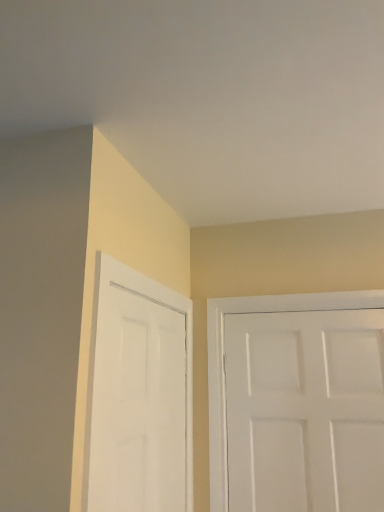
Question: Can you confirm if white matte door at left, placed as the 2th door when sorted from right to left, is bigger than white matte door at right, which is counted as the second door, starting from the left?

Choices:
 (A) yes
 (B) no

Answer: (A)

Question: Is white matte door at left, placed as the 2th door when sorted from right to left, taller than white matte door at right, the first door from the right?

Choices:
 (A) yes
 (B) no

Answer: (B)

Question: From the image's perspective, would you say white matte door at left, placed as the 2th door when sorted from right to left, is shown under white matte door at right, which is counted as the second door, starting from the left?

Choices:
 (A) yes
 (B) no

Answer: (B)

Question: Is white matte door at left, placed as the 2th door when sorted from right to left, shorter than white matte door at right, which is counted as the second door, starting from the left?

Choices:
 (A) yes
 (B) no

Answer: (A)

Question: Is white matte door at left, the first door positioned from the left, located outside white matte door at right, the first door from the right?

Choices:
 (A) no
 (B) yes

Answer: (B)

Question: Is white matte door at left, the first door positioned from the left, facing away from white matte door at right, the first door from the right?

Choices:
 (A) yes
 (B) no

Answer: (B)

Question: Does white matte door at right, the first door from the right, appear on the right side of white matte door at left, placed as the 2th door when sorted from right to left?

Choices:
 (A) yes
 (B) no

Answer: (A)

Question: Considering the relative sizes of white matte door at right, the first door from the right, and white matte door at left, the first door positioned from the left, in the image provided, is white matte door at right, the first door from the right, taller than white matte door at left, the first door positioned from the left,?

Choices:
 (A) no
 (B) yes

Answer: (B)

Question: Is there a large distance between white matte door at right, the first door from the right, and white matte door at left, placed as the 2th door when sorted from right to left?

Choices:
 (A) yes
 (B) no

Answer: (B)

Question: Is the position of white matte door at right, the first door from the right, more distant than that of white matte door at left, placed as the 2th door when sorted from right to left?

Choices:
 (A) no
 (B) yes

Answer: (B)

Question: Is white matte door at right, the first door from the right, with white matte door at left, the first door positioned from the left?

Choices:
 (A) yes
 (B) no

Answer: (B)

Question: Could white matte door at left, the first door positioned from the left, be considered to be inside white matte door at right, the first door from the right?

Choices:
 (A) yes
 (B) no

Answer: (B)

Question: Would you say white matte door at right, which is counted as the second door, starting from the left, is to the left or to the right of white matte door at left, the first door positioned from the left, in the picture?

Choices:
 (A) left
 (B) right

Answer: (B)